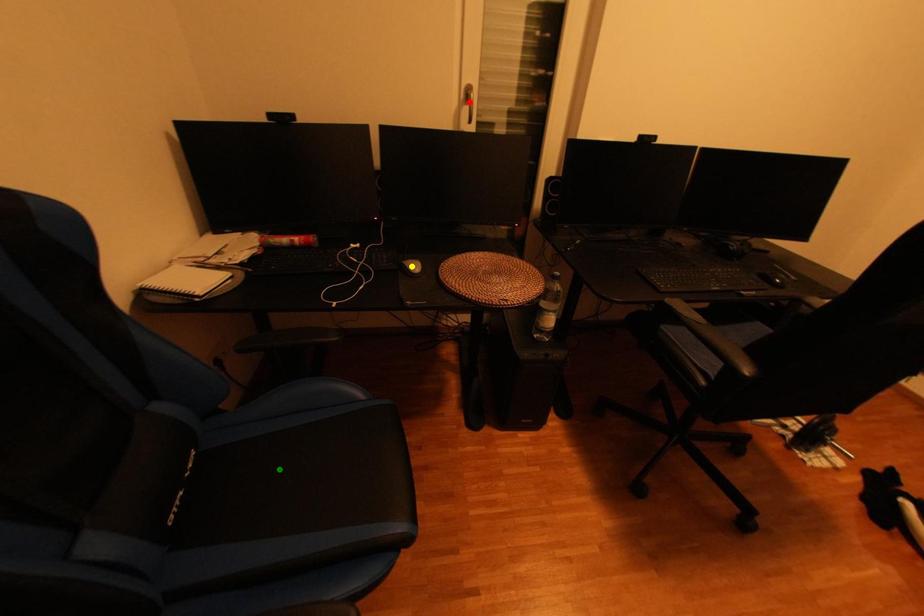
Order these from nearest to farthest:
A) green point
B) yellow point
C) red point

green point
yellow point
red point